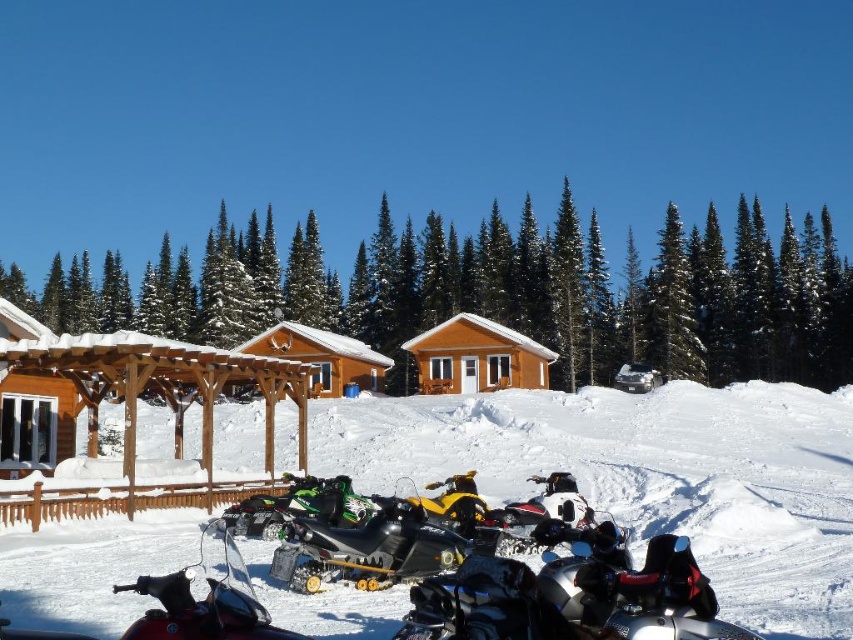
Consider the image. You are planning to park a new snowmobile that is 2 meters wide. You see the brown wooden cabin at center and the green matte snowmobile at center. Is there enough space between them to park the new snowmobile?

The brown wooden cabin at center might be wider than the green matte snowmobile at center, so there may not be enough space between them to park the new snowmobile that is 2 meters wide.

You are planning to take a photo of the wooden ski slope at center and the matte wood cabin at center from the front of the image. Which object should you focus on first to ensure both are in the frame?

You should focus on the wooden ski slope at center first since it is closer to the viewer than the matte wood cabin at center, ensuring both are in the frame by starting with the closer object.

You are planning to ski down the wooden ski slope at center from the matte wood cabin at center. In which direction should you head relative to the cabin?

You should head to the left relative to the matte wood cabin at center because the wooden ski slope at center is located to the left of the cabin.